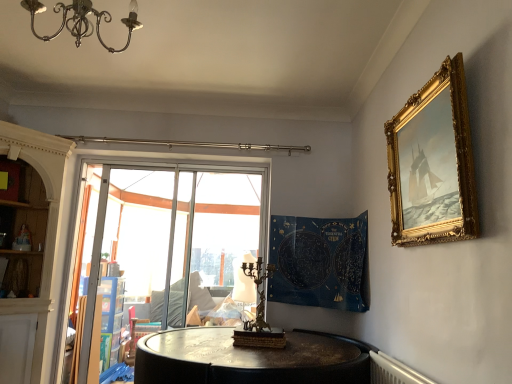
Question: Considering the relative positions of gold ornate frame at upper right and metallic chandelier at upper left in the image provided, is gold ornate frame at upper right to the right of metallic chandelier at upper left from the viewer's perspective?

Choices:
 (A) no
 (B) yes

Answer: (B)

Question: From the image's perspective, would you say gold ornate frame at upper right is shown under metallic chandelier at upper left?

Choices:
 (A) yes
 (B) no

Answer: (A)

Question: From the image's perspective, is gold ornate frame at upper right on top of metallic chandelier at upper left?

Choices:
 (A) yes
 (B) no

Answer: (B)

Question: Is gold ornate frame at upper right next to metallic chandelier at upper left?

Choices:
 (A) no
 (B) yes

Answer: (A)

Question: Is gold ornate frame at upper right facing towards metallic chandelier at upper left?

Choices:
 (A) no
 (B) yes

Answer: (B)

Question: Does gold ornate frame at upper right lie behind metallic chandelier at upper left?

Choices:
 (A) yes
 (B) no

Answer: (A)

Question: Is transparent glass window at center positioned with its back to blue fabric tapestry at center?

Choices:
 (A) yes
 (B) no

Answer: (B)

Question: Considering the relative sizes of transparent glass window at center and blue fabric tapestry at center in the image provided, is transparent glass window at center wider than blue fabric tapestry at center?

Choices:
 (A) yes
 (B) no

Answer: (B)

Question: From the image's perspective, would you say transparent glass window at center is positioned over blue fabric tapestry at center?

Choices:
 (A) yes
 (B) no

Answer: (B)

Question: From a real-world perspective, does transparent glass window at center stand above blue fabric tapestry at center?

Choices:
 (A) no
 (B) yes

Answer: (A)

Question: Is transparent glass window at center positioned beyond the bounds of blue fabric tapestry at center?

Choices:
 (A) yes
 (B) no

Answer: (A)

Question: Considering the relative positions of transparent glass window at center and blue fabric tapestry at center in the image provided, is transparent glass window at center to the left of blue fabric tapestry at center from the viewer's perspective?

Choices:
 (A) no
 (B) yes

Answer: (B)

Question: Does bronze/copper candle holder at center contain transparent glass window at center?

Choices:
 (A) yes
 (B) no

Answer: (B)